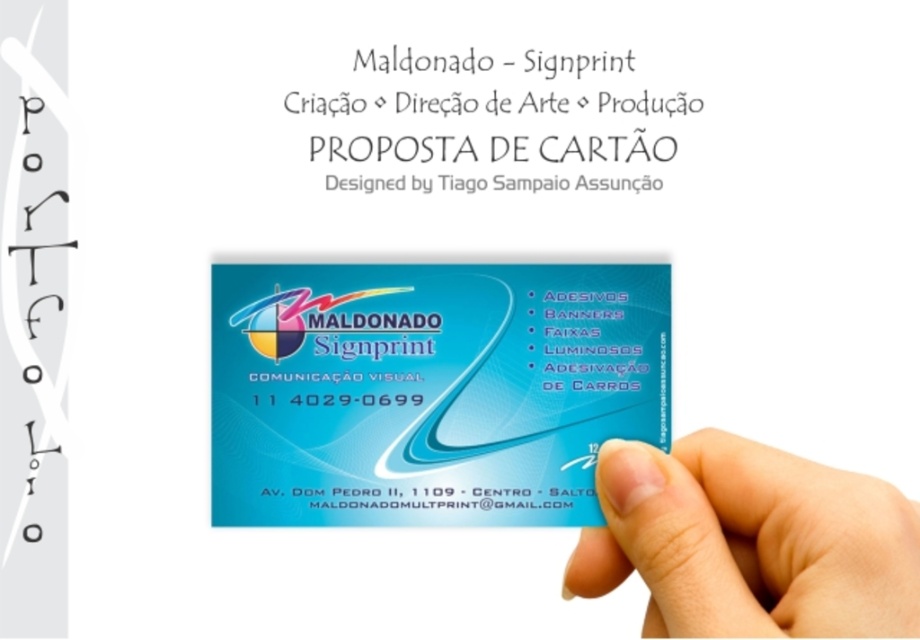
You are holding a camera and want to take a photo of the blue glossy business card at center. If the recommended distance for clear photos is 20 inches, should you move closer or farther away?

The blue glossy business card at center is 21.51 inches from the camera, which is slightly farther than the recommended 20 inches. To ensure a clear photo, you should move closer to the card so that the distance becomes 20 inches or less.

Please describe the position of the blue glossy business card at center in terms of its coordinates on a 1x1 grid where the bottom left corner is the origin point.

The blue glossy business card at center is located at coordinates approximately 0.609 on the x axis and 0.467 on the y axis on a 1x1 grid with the bottom left corner as the origin point.